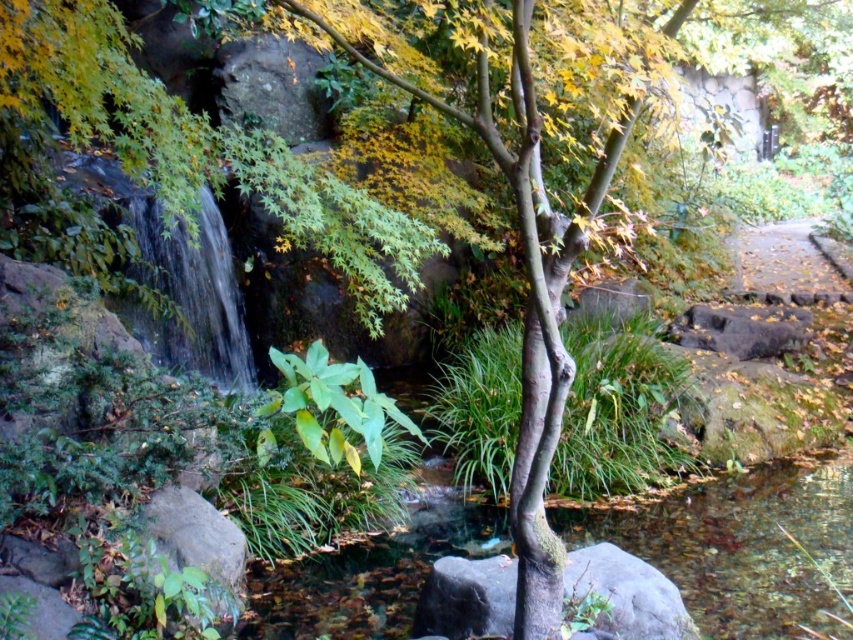
Question: Can you confirm if gray rough rock at center is wider than brown dirt path at right?

Choices:
 (A) yes
 (B) no

Answer: (B)

Question: Which point is closer to the camera taking this photo?

Choices:
 (A) pos(207,189)
 (B) pos(677,596)
 (C) pos(834,275)

Answer: (B)

Question: Is gray rough rock at center wider than brown dirt path at right?

Choices:
 (A) no
 (B) yes

Answer: (A)

Question: Is clear water at center wider than brown dirt path at right?

Choices:
 (A) no
 (B) yes

Answer: (A)

Question: Which object is closer to the camera taking this photo?

Choices:
 (A) brown dirt path at right
 (B) clear water at center

Answer: (B)

Question: Which object is positioned farthest from the brown dirt path at right?

Choices:
 (A) clear water at center
 (B) gray rough rock at center

Answer: (B)